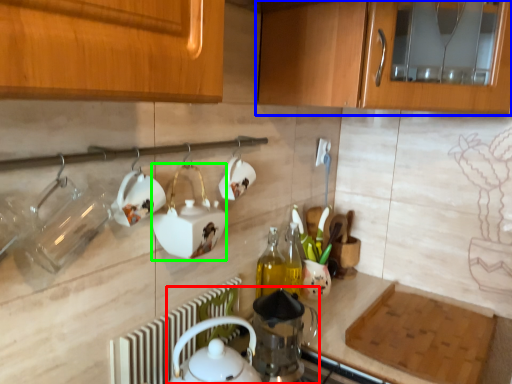
Question: Which object is the closest to the tea set (highlighted by a red box)? Choose among these: cabinetry (highlighted by a blue box) or appliance (highlighted by a green box).

Choices:
 (A) cabinetry
 (B) appliance

Answer: (B)